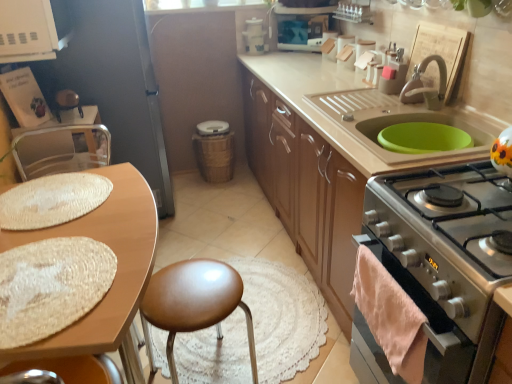
Find the location of `vacant space in front of woven brown trash can at center, which appears as the second appliance when viewed from the front`. vacant space in front of woven brown trash can at center, which appears as the second appliance when viewed from the front is located at coordinates (219, 193).